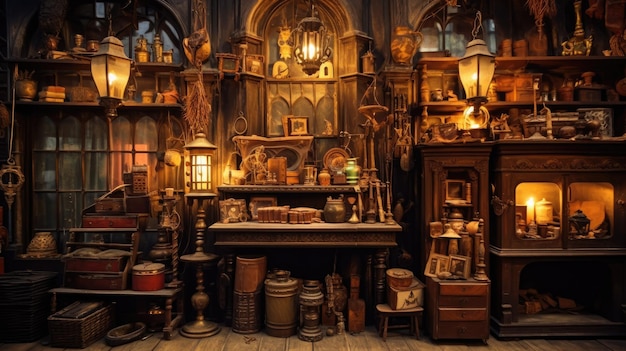
What are the coordinates of `cabinet` in the screenshot? It's located at (550, 161).